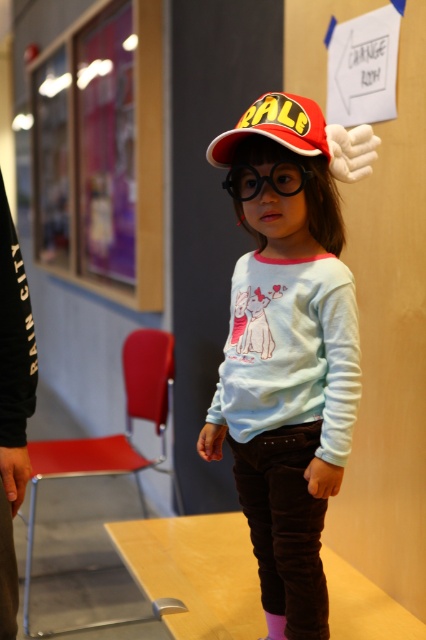
Which is in front, point (236, 138) or point (281, 173)?

Positioned in front is point (281, 173).

Between point (284, 145) and point (233, 180), which one is positioned behind?

The point (233, 180) is more distant.

The image size is (426, 640). What do you see at coordinates (275, 128) in the screenshot? I see `red matte baseball cap at center` at bounding box center [275, 128].

Where is `red matte baseball cap at center`? Image resolution: width=426 pixels, height=640 pixels. red matte baseball cap at center is located at coordinates (275, 128).

Consider the image. Does matte red cap at center have a lesser height compared to black plastic goggles at center?

No.

Does matte red cap at center lie behind black plastic goggles at center?

No, it is not.

Which is in front, point (275, 337) or point (270, 182)?

Point (270, 182) is in front.

What are the coordinates of `matte red cap at center` in the screenshot? It's located at (287, 358).

Does black cotton sweatshirt at left lie in front of black plastic goggles at center?

Yes, black cotton sweatshirt at left is in front of black plastic goggles at center.

Who is shorter, black cotton sweatshirt at left or black plastic goggles at center?

With less height is black plastic goggles at center.

Is point (20, 308) closer to camera compared to point (276, 170)?

Yes, point (20, 308) is in front of point (276, 170).

The width and height of the screenshot is (426, 640). I want to click on black cotton sweatshirt at left, so click(x=13, y=404).